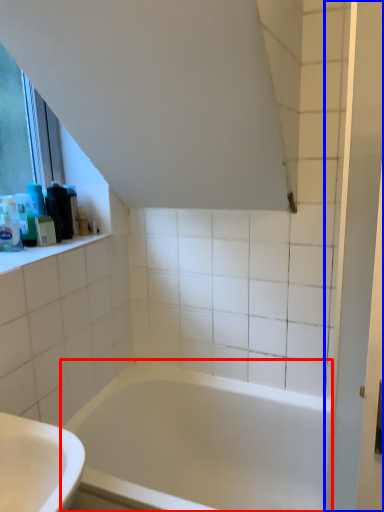
Question: Which object appears closest to the camera in this image, bathtub (highlighted by a red box) or screen door (highlighted by a blue box)?

Choices:
 (A) bathtub
 (B) screen door

Answer: (B)